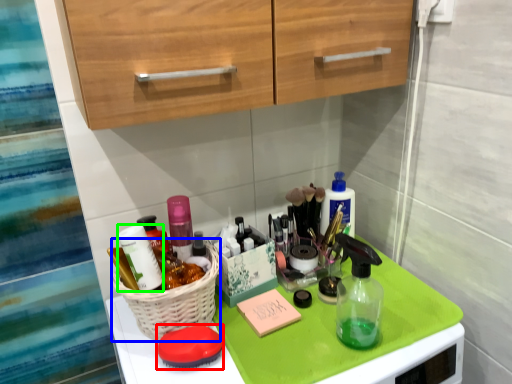
Question: Which object is the closest to the soap (highlighted by a red box)? Choose among these: basket (highlighted by a blue box) or toiletry (highlighted by a green box).

Choices:
 (A) basket
 (B) toiletry

Answer: (A)